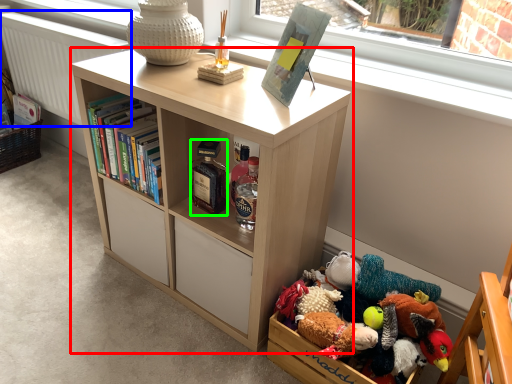
Question: Which object is the closest to the bookcase (highlighted by a red box)? Choose among these: radiator (highlighted by a blue box) or bottle (highlighted by a green box).

Choices:
 (A) radiator
 (B) bottle

Answer: (B)